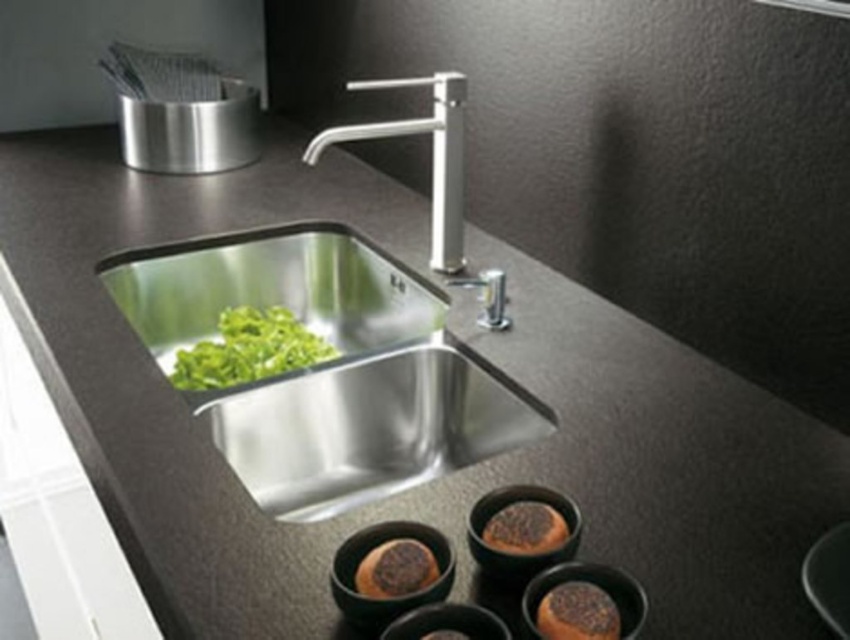
Question: Does brown crumbly bread at lower right appear under brown matte bread at lower right?

Choices:
 (A) no
 (B) yes

Answer: (B)

Question: Which of the following is the closest to the observer?

Choices:
 (A) polished stainless steel faucet at upper center
 (B) brown crumbly bread at lower right

Answer: (B)

Question: Estimate the real-world distances between objects in this image. Which object is farther from the brown crumbly bread at lower right?

Choices:
 (A) polished stainless steel faucet at upper center
 (B) stainless steel sink at center

Answer: (A)

Question: Which point is closer to the camera taking this photo?

Choices:
 (A) (392, 554)
 (B) (293, 362)
 (C) (476, 433)
 (D) (486, 524)

Answer: (A)

Question: Does stainless steel sink at center have a lesser width compared to brown matte bread at lower center?

Choices:
 (A) no
 (B) yes

Answer: (A)

Question: Can you confirm if brown matte bread at lower center is positioned below brown crumbly bread at lower center?

Choices:
 (A) no
 (B) yes

Answer: (A)